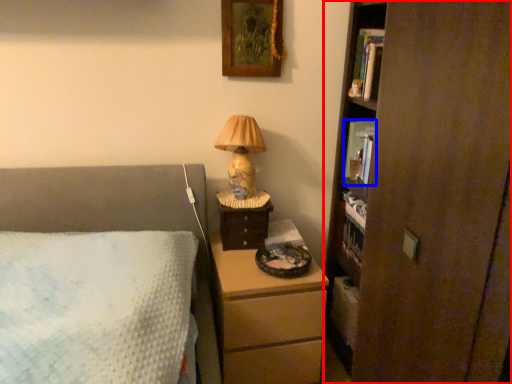
Question: Among these objects, which one is farthest to the camera, bookcase (highlighted by a red box) or book (highlighted by a blue box)?

Choices:
 (A) bookcase
 (B) book

Answer: (B)